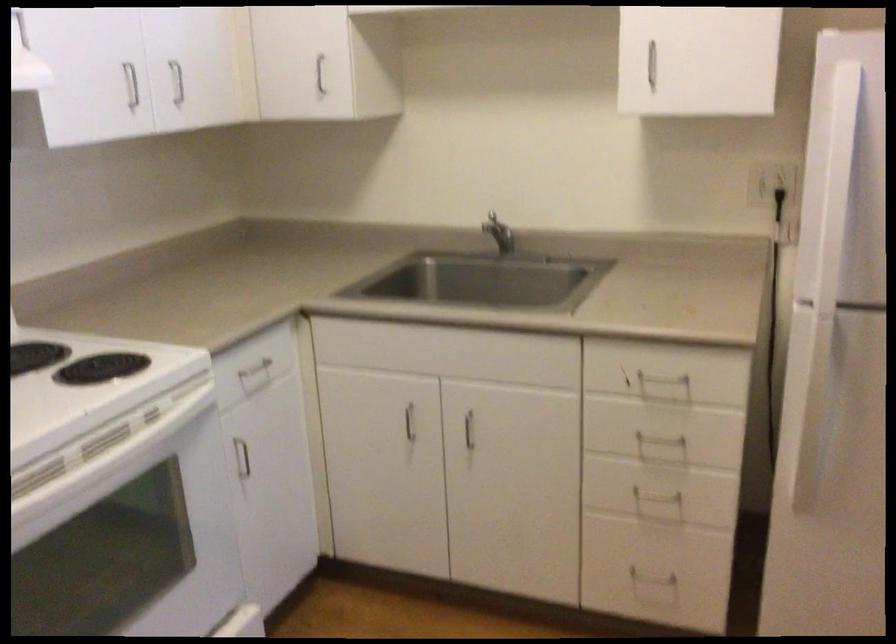
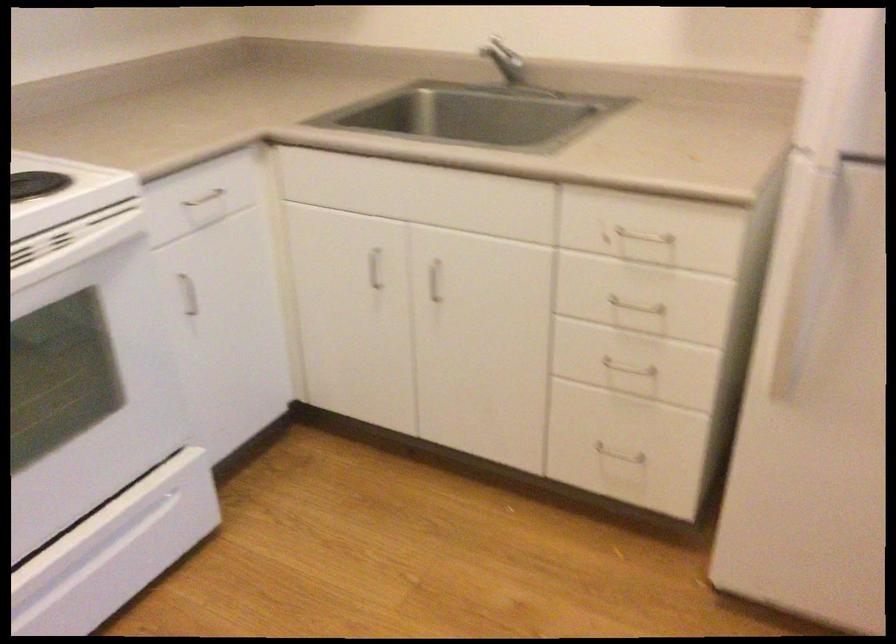
Question: The first image is from the beginning of the video and the second image is from the end. How did the camera likely rotate when shooting the video?

Choices:
 (A) Left
 (B) Right
 (C) Up
 (D) Down

Answer: (D)